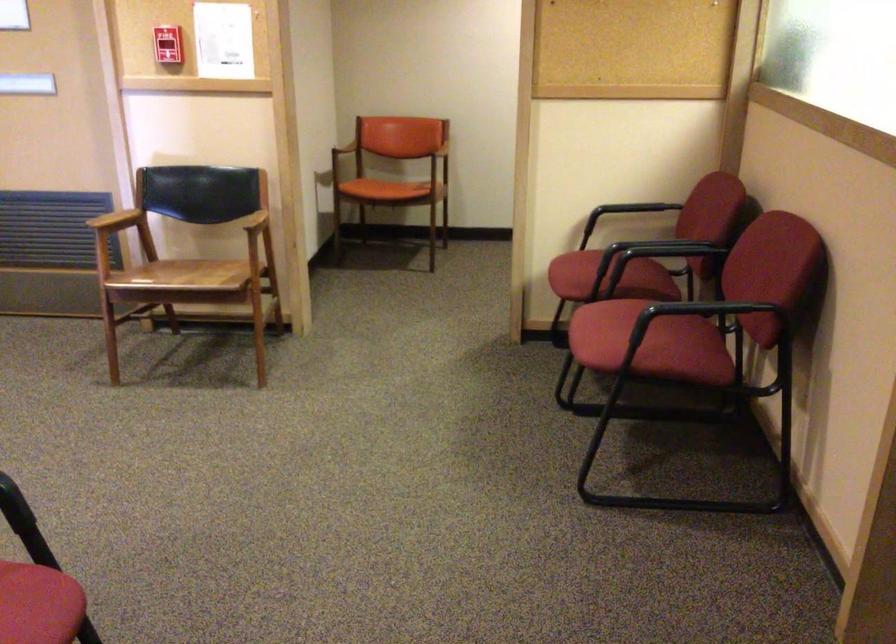
Where would you pull the fire alarm handle? Please return your answer as a coordinate pair (x, y).

(167, 44)